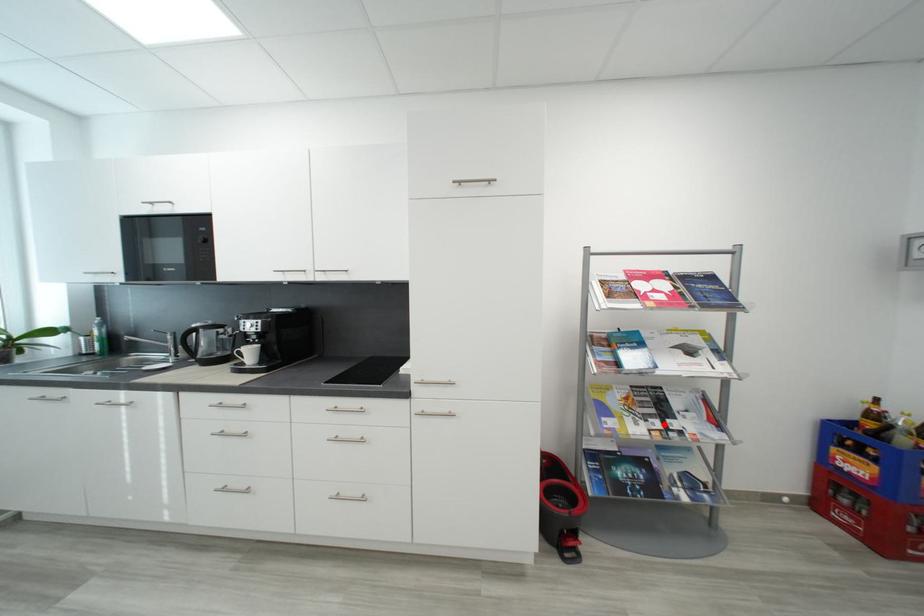
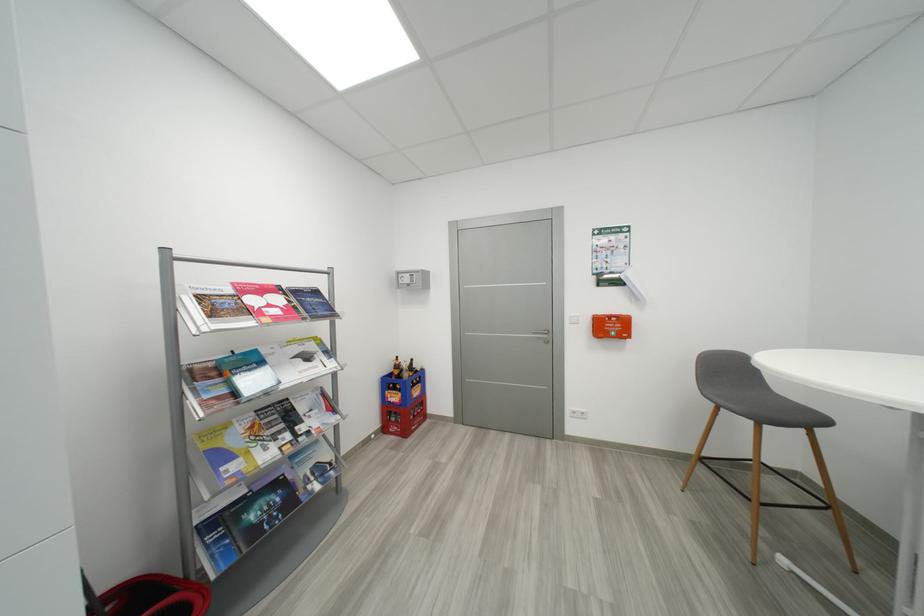
Question: I am providing you with two images of the same scene from different viewpoints. A red point is shown in image1. For the corresponding object point in image2, is it positioned nearer or farther from the camera?

Choices:
 (A) Nearer
 (B) Farther

Answer: (A)